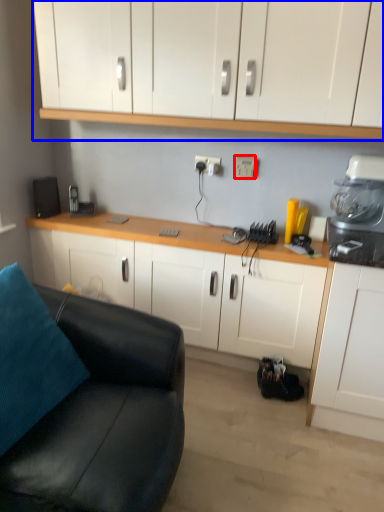
Question: Among these objects, which one is nearest to the camera, electric outlet (highlighted by a red box) or cabinetry (highlighted by a blue box)?

Choices:
 (A) electric outlet
 (B) cabinetry

Answer: (B)